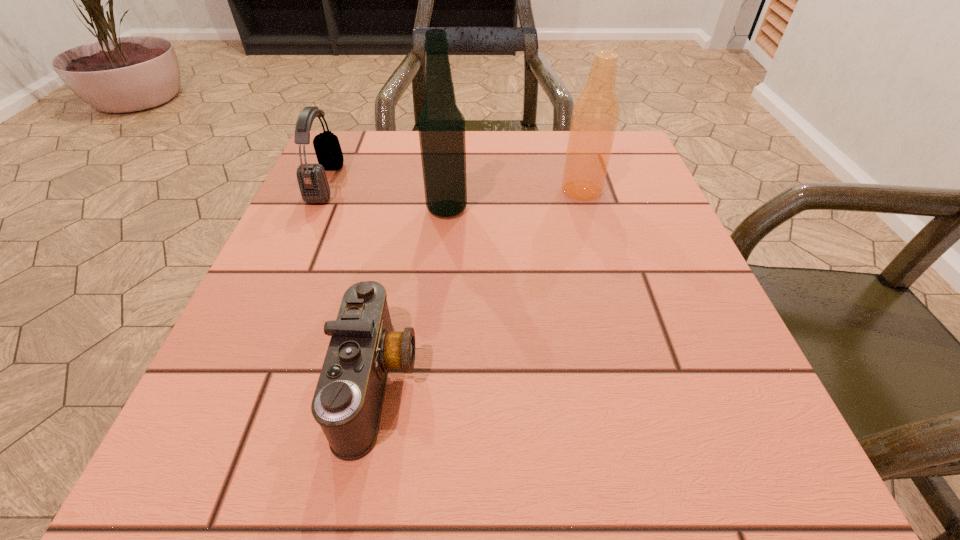
Where is `vacant space located 0.250m on the lens of the nearest object`? This screenshot has height=540, width=960. vacant space located 0.250m on the lens of the nearest object is located at coordinates (603, 382).

At what (x,y) coordinates should I click in order to perform the action: click on beer bottle that is at the far edge. Please return your answer as a coordinate pair (x, y). This screenshot has height=540, width=960. Looking at the image, I should click on (595, 115).

Locate an element on the screen. Image resolution: width=960 pixels, height=540 pixels. headset that is at the far edge is located at coordinates (312, 180).

At what (x,y) coordinates should I click in order to perform the action: click on object present at the near edge. Please return your answer as a coordinate pair (x, y). Looking at the image, I should click on (347, 404).

Find the location of a particular element. The width and height of the screenshot is (960, 540). object positioned at the left edge is located at coordinates (312, 180).

In order to click on object positioned at the right edge in this screenshot , I will do `click(595, 115)`.

What are the coordinates of `object that is at the far left corner` in the screenshot? It's located at (312, 180).

This screenshot has height=540, width=960. I want to click on object that is at the far right corner, so click(595, 115).

This screenshot has height=540, width=960. Identify the location of vacant area at the far edge of the desktop. (497, 139).

I want to click on vacant area at the left edge, so click(349, 251).